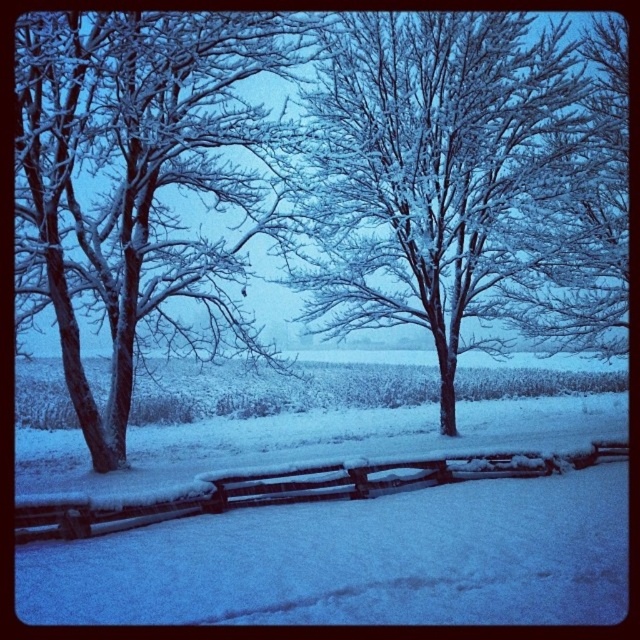
Does point (234, 342) come closer to viewer compared to point (211, 486)?

No, (234, 342) is further to viewer.

Based on the photo, can you confirm if snow-covered branches at left is taller than snow-covered wooden fence at center?

Incorrect, snow-covered branches at left's height is not larger of snow-covered wooden fence at center's.

Locate an element on the screen. snow-covered branches at left is located at coordinates (141, 182).

The width and height of the screenshot is (640, 640). I want to click on snow-covered branches at left, so click(x=141, y=182).

From the picture: Who is taller, snow-covered branches at center or snow-covered branches at left?

snow-covered branches at left is taller.

From the picture: Does snow-covered branches at center have a greater width compared to snow-covered branches at left?

Incorrect, snow-covered branches at center's width does not surpass snow-covered branches at left's.

Locate an element on the screen. The width and height of the screenshot is (640, 640). snow-covered branches at center is located at coordinates (449, 177).

In order to click on snow-covered branches at center in this screenshot , I will do click(x=449, y=177).

Which is more to the left, snow-covered branches at center or snow-covered wooden fence at center?

Positioned to the left is snow-covered wooden fence at center.

Is point (563, 145) more distant than point (284, 490)?

Yes, point (563, 145) is behind point (284, 490).

Identify the location of snow-covered branches at center. Image resolution: width=640 pixels, height=640 pixels. (449, 177).